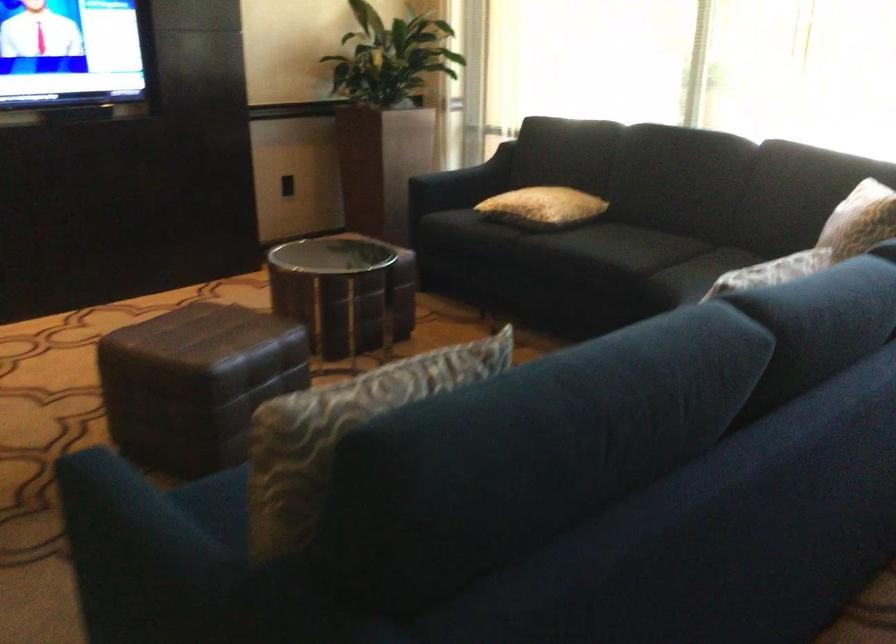
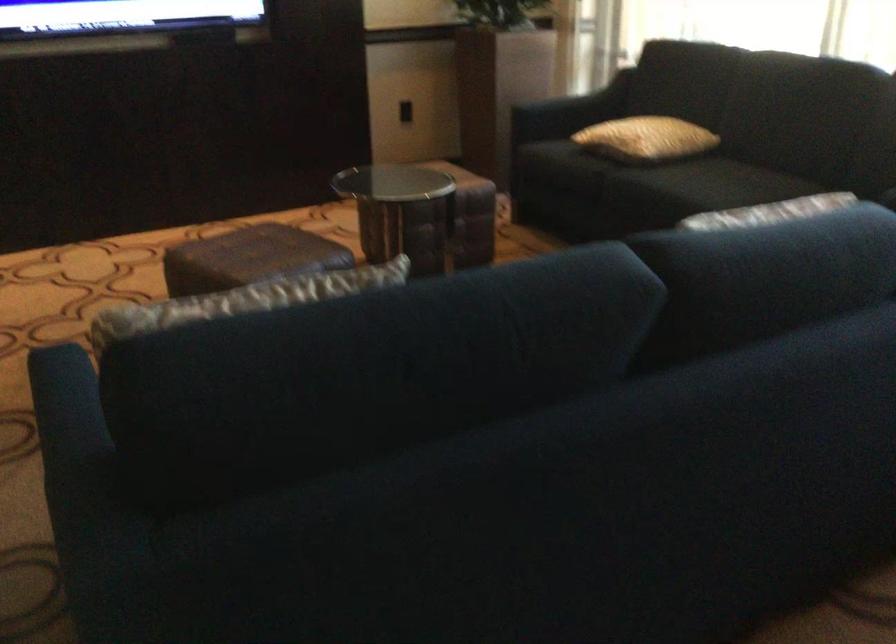
Find the pixel in the second image that matches point 616,245 in the first image.

(709, 184)